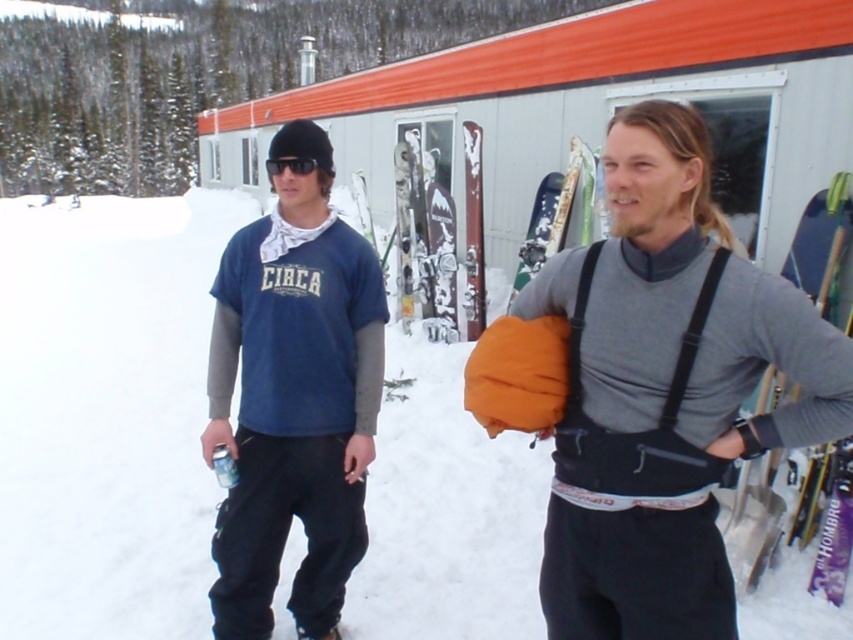
Can you confirm if matte blue sweatshirt at center is wider than matte blue t-shirt at center?

Correct, the width of matte blue sweatshirt at center exceeds that of matte blue t-shirt at center.

Who is shorter, matte blue sweatshirt at center or matte blue t-shirt at center?

With less height is matte blue sweatshirt at center.

Is point (642, 621) farther from camera compared to point (207, 426)?

No, (642, 621) is in front of (207, 426).

Find the location of a particular element. The width and height of the screenshot is (853, 640). matte blue sweatshirt at center is located at coordinates (666, 388).